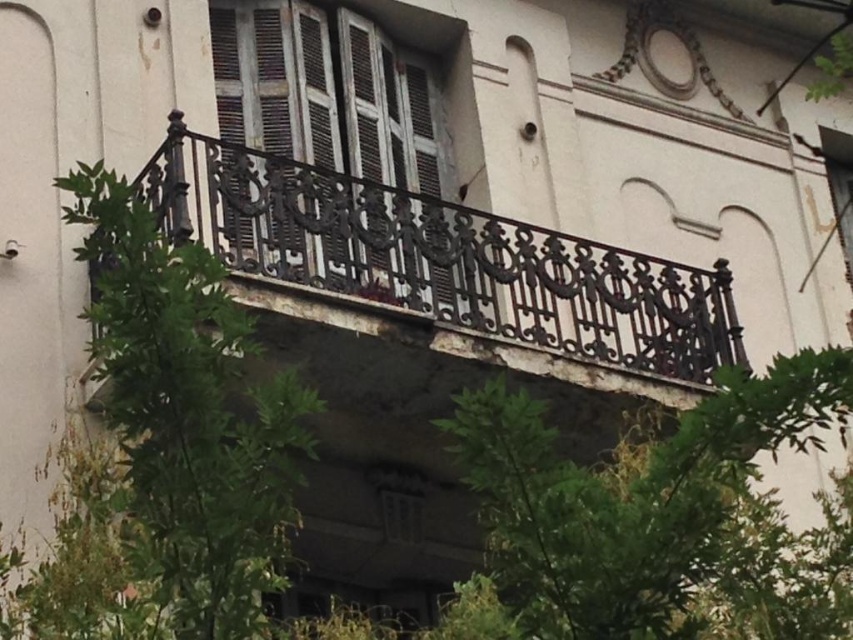
Who is more distant from viewer, (589,252) or (242,22)?

Positioned behind is point (242,22).

Locate an element on the screen. rusty metal balustrade at upper center is located at coordinates (445, 272).

Is point (248, 272) closer to camera compared to point (291, 516)?

That is False.

Which is above, rusty metal balustrade at upper center or green leafy tree at lower left?

rusty metal balustrade at upper center is higher up.

Is point (434, 346) farther from viewer compared to point (165, 410)?

Yes, it is.

You are a GUI agent. You are given a task and a screenshot of the screen. Output one action in this format:
    pyautogui.click(x=<x>, y=<y>)
    Task: Click on the rusty metal balustrade at upper center
    The width and height of the screenshot is (853, 640).
    Given the screenshot: What is the action you would take?
    pyautogui.click(x=445, y=272)

In the scene shown: Between green leafy tree at lower left and wooden shutters at center, which one is positioned lower?

Positioned lower is green leafy tree at lower left.

Can you confirm if green leafy tree at lower left is taller than wooden shutters at center?

No, green leafy tree at lower left is not taller than wooden shutters at center.

This screenshot has width=853, height=640. I want to click on green leafy tree at lower left, so click(189, 413).